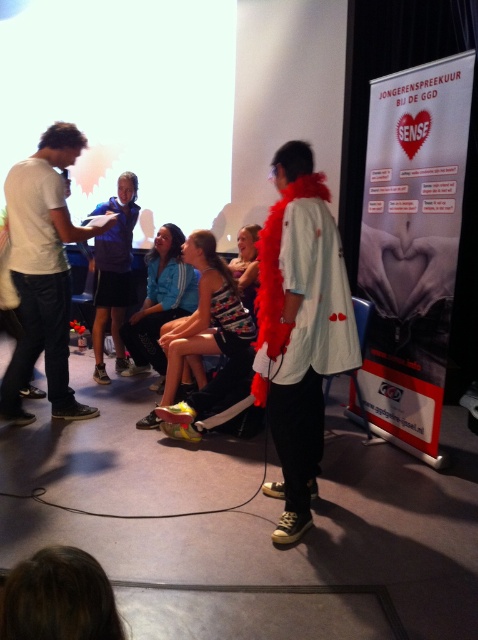
You are organizing a photo shoot and need to ensure that the blue fabric jacket at center and the dark blue shirt at center are positioned exactly 36 centimeters apart for a closeup shot. Based on the current setup, will you need to adjust their positions?

The distance between the blue fabric jacket at center and the dark blue shirt at center is already 36.28 centimeters, which is very close to the desired 36 centimeters. A slight adjustment might be needed to meet the exact requirement.

You are standing at the point labeled point (x=44, y=204) and want to move to the front of the room. There is a point labeled point (x=317, y=449) in your path. Can you walk directly towards the front without going around it?

Yes, you can walk directly towards the front because point (x=317, y=449) is in front of point (x=44, y=204), meaning it is along your path to the front.

You are an attendee at this event and want to see both the white matte jacket at center and the matte blue jacket at center clearly. Which one is positioned higher in the image?

The white matte jacket at center is located above the matte blue jacket at center, so it is positioned higher in the image.